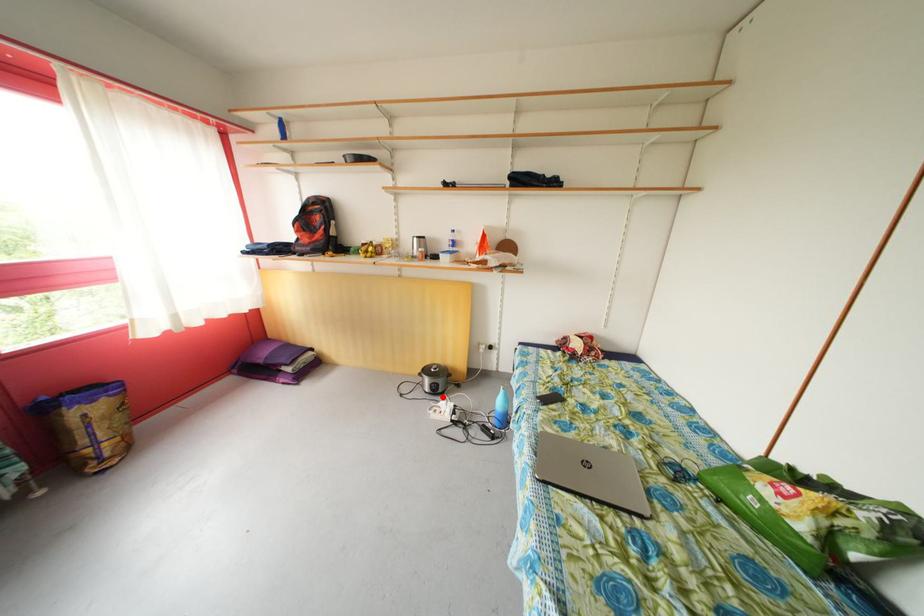
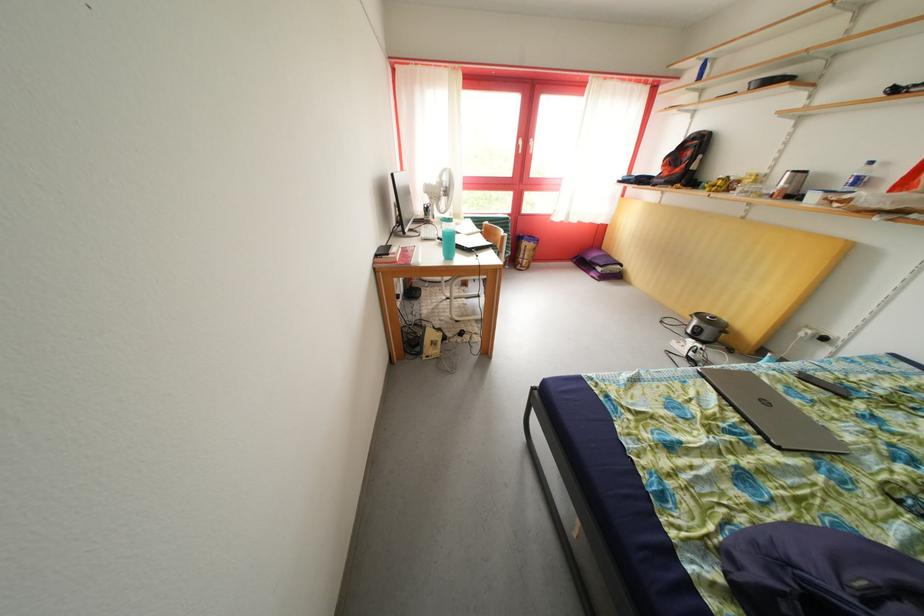
In the second image, find the point that corresponds to the highlighted location in the first image.

(702, 342)